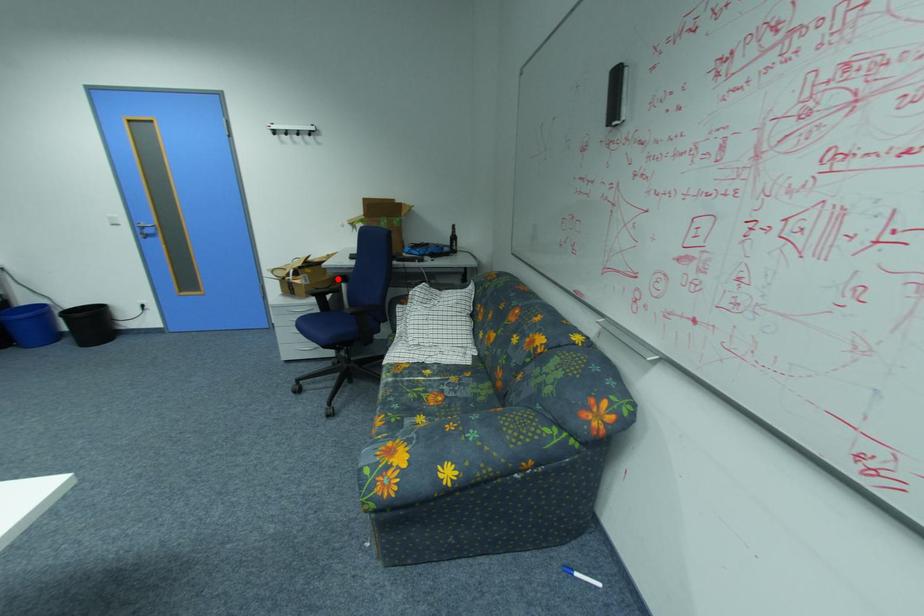
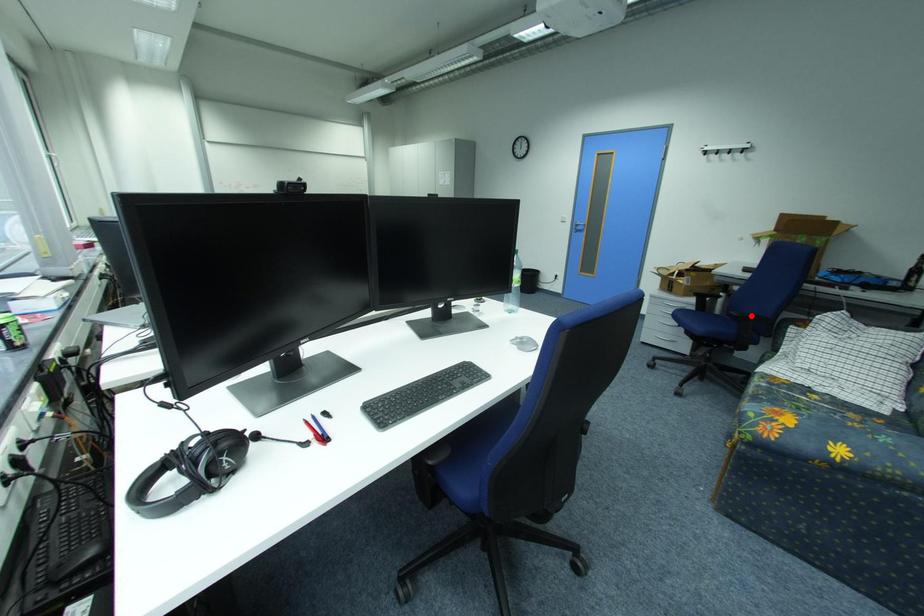
I am providing you with two images of the same scene from different viewpoints. A red point is marked on the first image and another point is marked on the second image. Is the red point in image1 aligned with the point shown in image2?

No